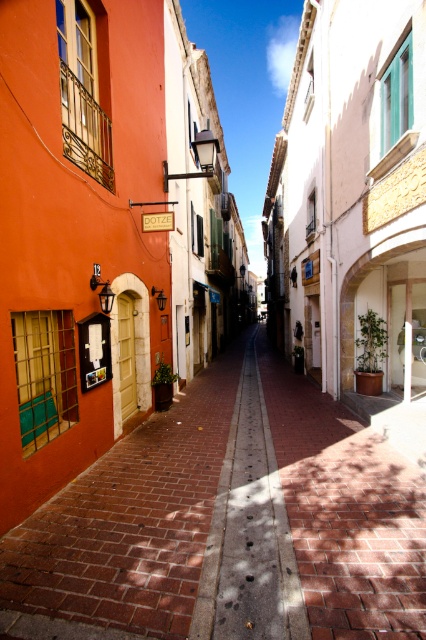
Question: Can you confirm if smooth brick pavement at center is positioned above brick pavement at center?

Choices:
 (A) yes
 (B) no

Answer: (B)

Question: Which object is farther from the camera taking this photo?

Choices:
 (A) brick pavement at center
 (B) smooth brick pavement at center

Answer: (A)

Question: Which of the following is the closest to the observer?

Choices:
 (A) brick pavement at center
 (B) smooth brick pavement at center

Answer: (B)

Question: Can you confirm if smooth brick pavement at center is thinner than brick pavement at center?

Choices:
 (A) yes
 (B) no

Answer: (B)

Question: Which of the following is the closest to the observer?

Choices:
 (A) brick pavement at center
 (B) smooth brick pavement at center

Answer: (B)

Question: Is smooth brick pavement at center in front of brick pavement at center?

Choices:
 (A) no
 (B) yes

Answer: (B)